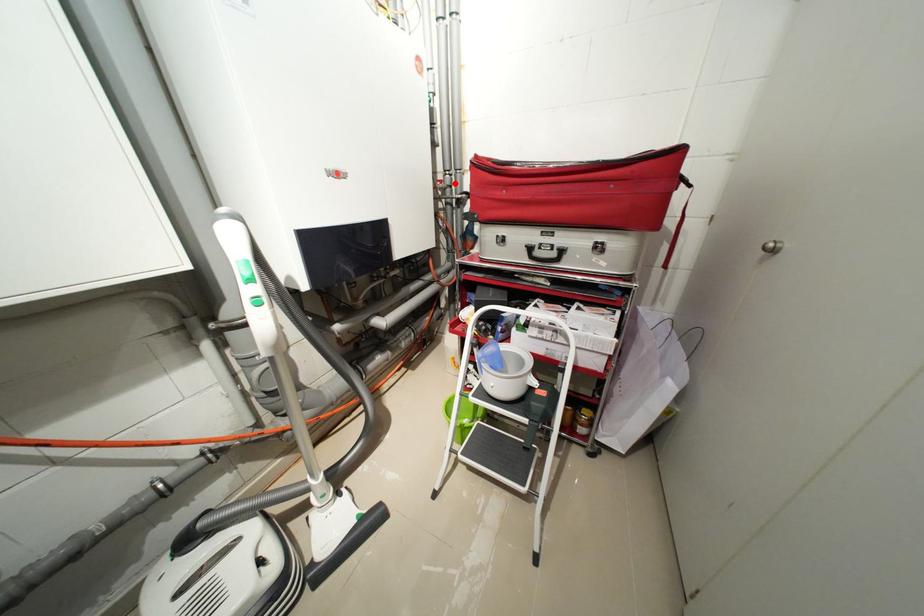
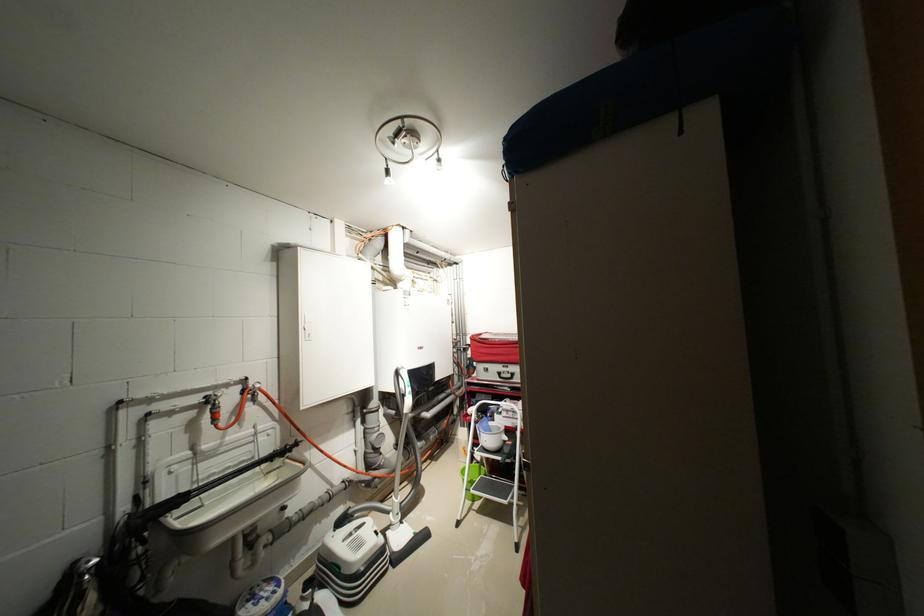
Question: I am providing you with two images of the same scene from different viewpoints. A red point is marked on the first image. At the location where the point appears in image 1, is it still visible in image 2?

Choices:
 (A) Yes
 (B) No

Answer: (A)